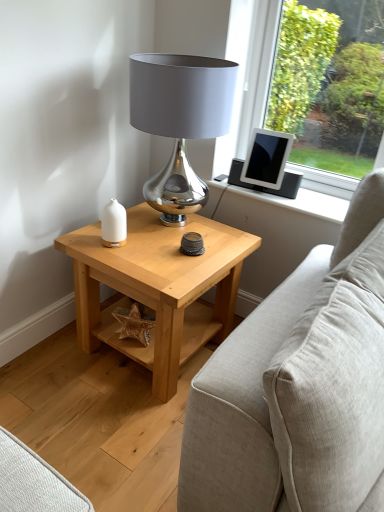
At what (x,y) coordinates should I click in order to perform the action: click on vacant area situated below shiny metallic lamp at center (from a real-world perspective). Please return your answer as a coordinate pair (x, y). Looking at the image, I should click on (183, 226).